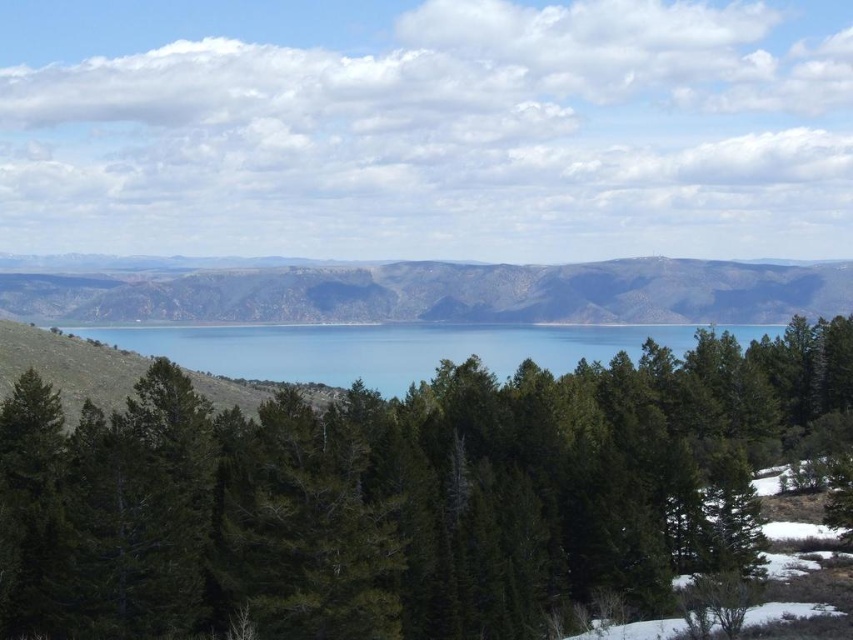
Question: Which of the following is the closest to the observer?

Choices:
 (A) (598, 310)
 (B) (717, 332)

Answer: (B)

Question: Can you confirm if green matte tree at center is positioned to the right of brown rocky mountains at center?

Choices:
 (A) yes
 (B) no

Answer: (A)

Question: Among these objects, which one is farthest from the camera?

Choices:
 (A) brown rocky mountains at center
 (B) blue water at center

Answer: (A)

Question: Is green matte tree at center positioned in front of blue water at center?

Choices:
 (A) yes
 (B) no

Answer: (A)

Question: Can you confirm if brown rocky mountains at center is positioned above blue water at center?

Choices:
 (A) no
 (B) yes

Answer: (B)

Question: Which of these objects is positioned closest to the blue water at center?

Choices:
 (A) green matte tree at center
 (B) brown rocky mountains at center

Answer: (B)